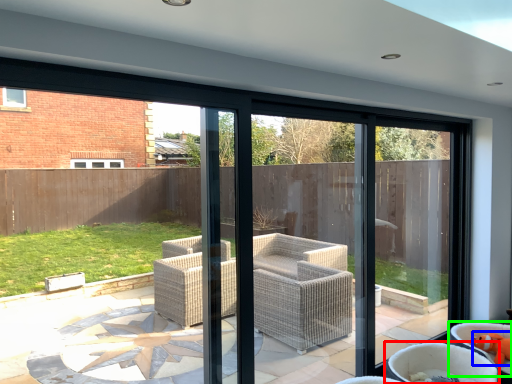
Question: Which is nearer to the chair (highlighted by a red box)? toy (highlighted by a blue box) or chair (highlighted by a green box).

Choices:
 (A) toy
 (B) chair

Answer: (B)